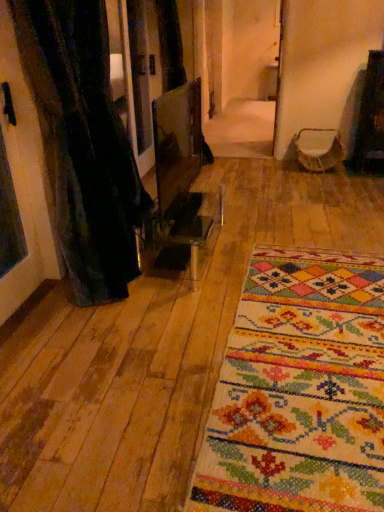
Identify the location of velvet-like beige armchair at center. (318, 149).

In the image, there is a black textured curtain at left. Identify the location of armchair above it (from the image's perspective). (318, 149).

Looking at this image, from a real-world perspective, between velvet-like beige armchair at center and black textured curtain at left, who is vertically lower?

In real-world perspective, velvet-like beige armchair at center is lower.

From the image's perspective, between velvet-like beige armchair at center and black textured curtain at left, who is located below?

black textured curtain at left is shown below in the image.

Looking at their sizes, would you say velvet-like beige armchair at center is wider or thinner than black textured curtain at left?

In the image, velvet-like beige armchair at center appears to be wider than black textured curtain at left.

Is multicolored woven rug at center facing towards velvet-like beige armchair at center?

No, multicolored woven rug at center is not turned towards velvet-like beige armchair at center.

Would you say multicolored woven rug at center contains velvet-like beige armchair at center?

No, multicolored woven rug at center does not contain velvet-like beige armchair at center.

From their relative heights in the image, would you say multicolored woven rug at center is taller or shorter than velvet-like beige armchair at center?

In the image, multicolored woven rug at center appears to be shorter than velvet-like beige armchair at center.

Between point (340, 329) and point (331, 154), which one is positioned in front?

Point (340, 329)

Is velvet-like beige armchair at center closer to camera compared to multicolored woven rug at center?

No, the depth of velvet-like beige armchair at center is greater than that of multicolored woven rug at center.

Consider the image. Does velvet-like beige armchair at center have a greater width compared to multicolored woven rug at center?

In fact, velvet-like beige armchair at center might be narrower than multicolored woven rug at center.

Can you confirm if velvet-like beige armchair at center is shorter than multicolored woven rug at center?

In fact, velvet-like beige armchair at center may be taller than multicolored woven rug at center.

Is velvet-like beige armchair at center next to multicolored woven rug at center?

They are not placed beside each other.

Considering the relative positions of multicolored woven rug at center and black textured curtain at left in the image provided, is multicolored woven rug at center to the right of black textured curtain at left from the viewer's perspective?

Yes, multicolored woven rug at center is to the right of black textured curtain at left.

Does multicolored woven rug at center have a lesser width compared to black textured curtain at left?

No, multicolored woven rug at center is not thinner than black textured curtain at left.

Where is `curtain above the multicolored woven rug at center (from the image's perspective)`? This screenshot has height=512, width=384. curtain above the multicolored woven rug at center (from the image's perspective) is located at coordinates (84, 143).

Considering the relative positions of black textured curtain at left and multicolored woven rug at center in the image provided, is black textured curtain at left to the right of multicolored woven rug at center from the viewer's perspective?

Incorrect, black textured curtain at left is not on the right side of multicolored woven rug at center.

Between point (134, 232) and point (262, 289), which one is positioned behind?

The point (134, 232) is farther.

Is black textured curtain at left not close to multicolored woven rug at center?

Yes.

Can you see black textured curtain at left touching velvet-like beige armchair at center?

black textured curtain at left and velvet-like beige armchair at center are clearly separated.

From the image's perspective, is black textured curtain at left above or below velvet-like beige armchair at center?

Clearly, from the image's perspective, black textured curtain at left is below velvet-like beige armchair at center.

In the scene shown: From a real-world perspective, between black textured curtain at left and velvet-like beige armchair at center, who is vertically lower?

velvet-like beige armchair at center, from a real-world perspective.

From their relative heights in the image, would you say black textured curtain at left is taller or shorter than velvet-like beige armchair at center?

In the image, black textured curtain at left appears to be taller than velvet-like beige armchair at center.

Find the location of a particular element. The width and height of the screenshot is (384, 512). curtain in front of the velvet-like beige armchair at center is located at coordinates pos(84,143).

Identify the location of mat on the left of the velvet-like beige armchair at center. (299, 390).

Looking at this image, estimate the real-world distances between objects in this image. Which object is closer to velvet-like beige armchair at center, multicolored woven rug at center or black textured curtain at left?

black textured curtain at left is closer to velvet-like beige armchair at center.

Which object lies further to the anchor point velvet-like beige armchair at center, black textured curtain at left or multicolored woven rug at center?

multicolored woven rug at center lies further to velvet-like beige armchair at center than the other object.

Considering their positions, is black textured curtain at left positioned further to multicolored woven rug at center than velvet-like beige armchair at center?

The object further to multicolored woven rug at center is velvet-like beige armchair at center.

From the image, which object appears to be nearer to black textured curtain at left, velvet-like beige armchair at center or multicolored woven rug at center?

multicolored woven rug at center is positioned closer to the anchor black textured curtain at left.

Looking at the image, which one is located closer to multicolored woven rug at center, velvet-like beige armchair at center or black textured curtain at left?

Among the two, black textured curtain at left is located nearer to multicolored woven rug at center.

Based on their spatial positions, is multicolored woven rug at center or velvet-like beige armchair at center closer to black textured curtain at left?

The object closer to black textured curtain at left is multicolored woven rug at center.

What are the coordinates of `curtain positioned between multicolored woven rug at center and velvet-like beige armchair at center from near to far` in the screenshot? It's located at point(84,143).